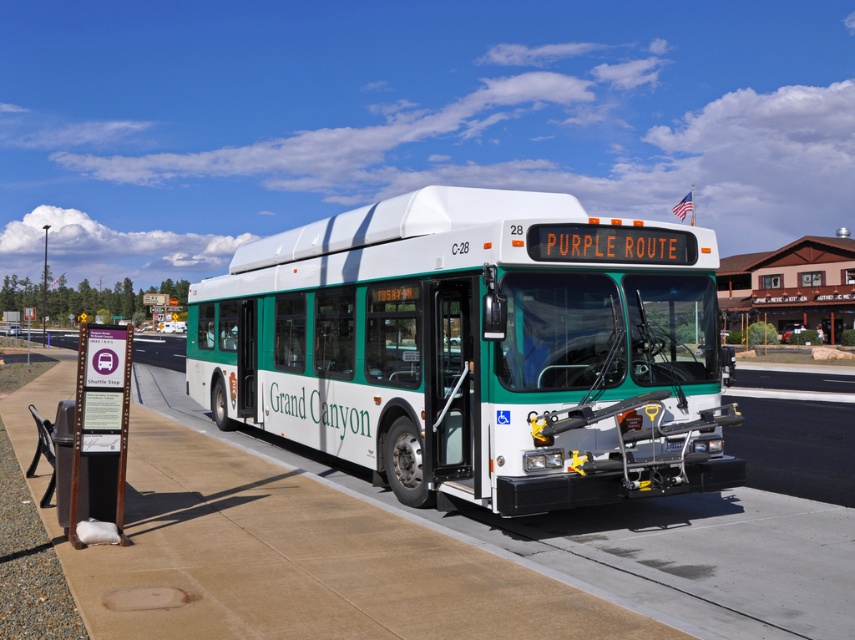
Does green matte bus at center appear under white plastic bus stop at center?

Correct, green matte bus at center is located below white plastic bus stop at center.

Can you confirm if green matte bus at center is smaller than white plastic bus stop at center?

Yes.

Between point (451, 232) and point (744, 292), which one is positioned in front?

Point (451, 232) is in front.

You are a GUI agent. You are given a task and a screenshot of the screen. Output one action in this format:
    pyautogui.click(x=<x>, y=<y>)
    Task: Click on the green matte bus at center
    
    Given the screenshot: What is the action you would take?
    pyautogui.click(x=476, y=348)

The height and width of the screenshot is (640, 855). What are the coordinates of `green matte bus at center` in the screenshot? It's located at (476, 348).

Which is in front, point (463, 224) or point (376, 513)?

Point (376, 513)

What do you see at coordinates (476, 348) in the screenshot?
I see `green matte bus at center` at bounding box center [476, 348].

Where is `green matte bus at center`? green matte bus at center is located at coordinates (476, 348).

Does brown concrete pavement at center appear under white plastic bus stop at center?

Yes.

Which is more to the right, brown concrete pavement at center or white plastic bus stop at center?

Positioned to the right is white plastic bus stop at center.

Identify the location of brown concrete pavement at center. This screenshot has width=855, height=640. (439, 554).